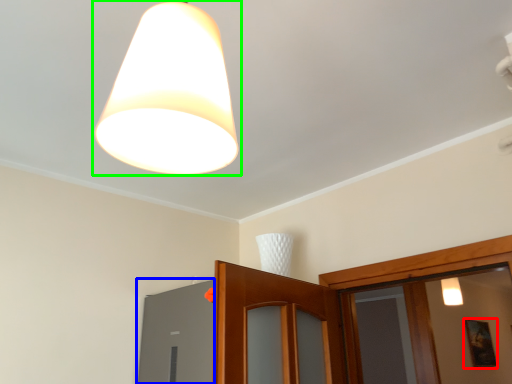
Question: Based on their relative distances, which object is farther from picture frame (highlighted by a red box)? Choose from window (highlighted by a blue box) and lamp (highlighted by a green box).

Choices:
 (A) window
 (B) lamp

Answer: (B)